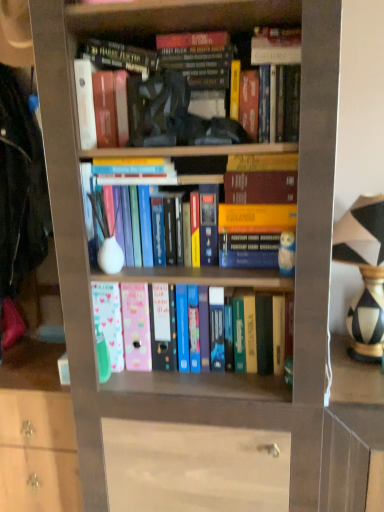
Question: In the image, is black-and-white striped vase at right on the left side or the right side of hardcover book at upper center, which is the 1th book in top-to-bottom order?

Choices:
 (A) right
 (B) left

Answer: (A)

Question: From the image's perspective, is black-and-white striped vase at right positioned above or below hardcover book at upper center, which is the 1th book in top-to-bottom order?

Choices:
 (A) above
 (B) below

Answer: (B)

Question: Which object is positioned closest to the hardcover book at upper center, which is the 1th book in top-to-bottom order?

Choices:
 (A) hardcover book at upper center, which is the 2th book from top to bottom
 (B) black-and-white striped vase at right
 (C) pastel matte file folders at center, placed as the first book when sorted from bottom to top

Answer: (A)

Question: Considering the real-world distances, which object is farthest from the pastel matte file folders at center, arranged as the 3th book when viewed from the top?

Choices:
 (A) hardcover book at upper center, which appears as the 2th book when ordered from the bottom
 (B) black-and-white striped vase at right
 (C) hardcover book at upper center, which is the 1th book in top-to-bottom order

Answer: (A)